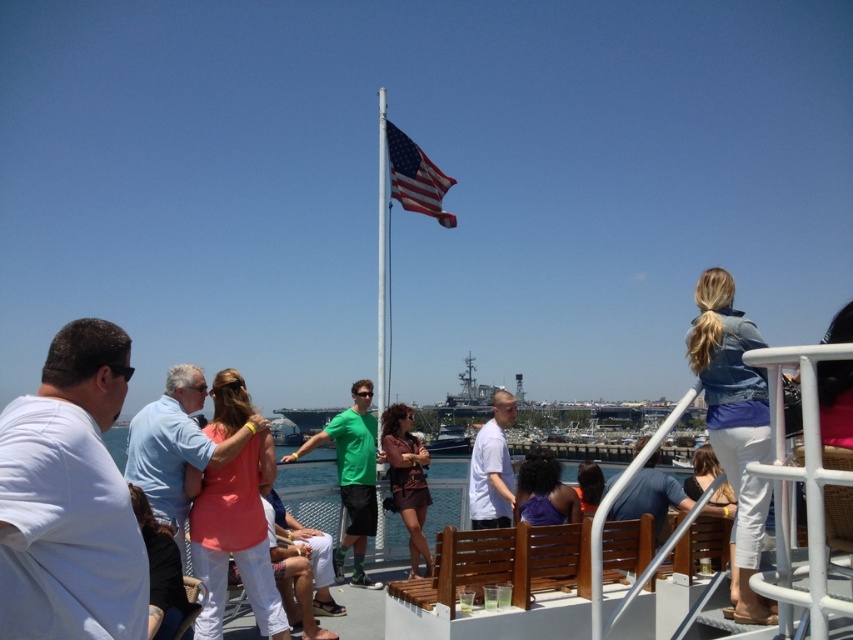
Is white matte shirt at left to the left of coral fabric shirt at center from the viewer's perspective?

Correct, you'll find white matte shirt at left to the left of coral fabric shirt at center.

In the scene shown: Which is below, white matte shirt at left or coral fabric shirt at center?

Positioned lower is coral fabric shirt at center.

In order to click on white matte shirt at left in this screenshot , I will do `click(68, 499)`.

Between coral fabric shirt at center and purple matte shirt at center, which one appears on the left side from the viewer's perspective?

coral fabric shirt at center is more to the left.

Who is shorter, coral fabric shirt at center or purple matte shirt at center?

coral fabric shirt at center

Is point (258, 484) behind point (563, 577)?

Yes, point (258, 484) is behind point (563, 577).

Where is `coral fabric shirt at center`? Image resolution: width=853 pixels, height=640 pixels. coral fabric shirt at center is located at coordinates (234, 536).

Can you confirm if coral fabric shirt at center is taller than brown leather jacket at center?

Yes, coral fabric shirt at center is taller than brown leather jacket at center.

Which is in front, point (202, 513) or point (386, 417)?

Point (202, 513) is more forward.

The image size is (853, 640). What are the coordinates of `coral fabric shirt at center` in the screenshot? It's located at (234, 536).